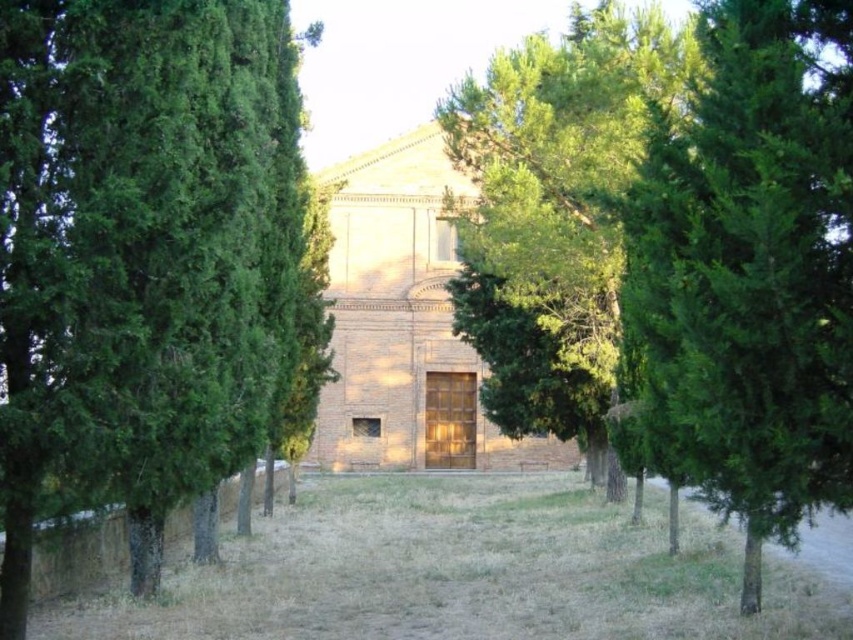
You are a gardener assessing the outdoor space. You notice the green textured tree at left and the dry grass at center. Which of these two elements is taller?

The green textured tree at left is taller than the dry grass at center.

You are a gardener planning to plant a new row of shrubs between the green textured tree at center and the green leafy tree at center. Given their current widths, which tree would require more space to accommodate the shrubs?

The green leafy tree at center requires more space because its width is greater than the green textured tree at center.